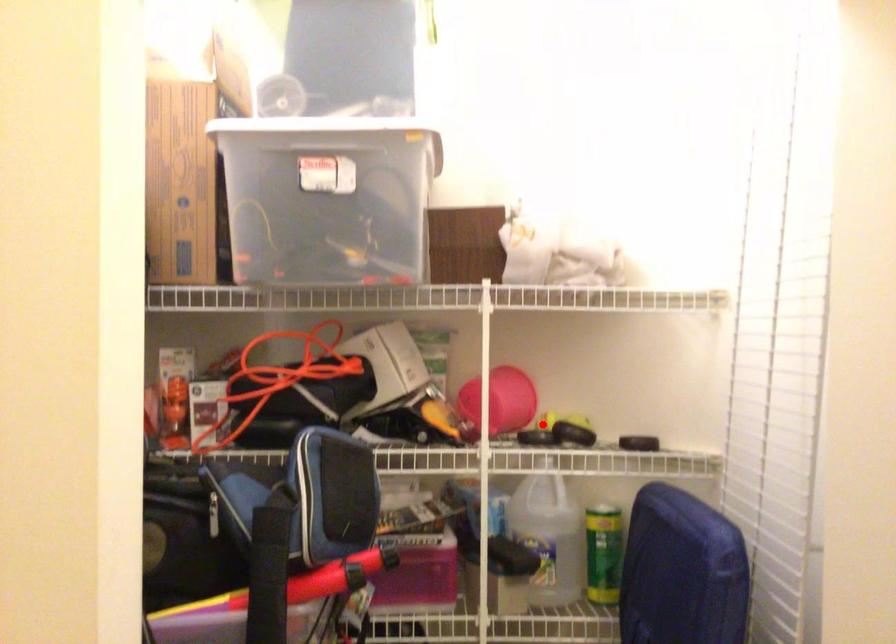
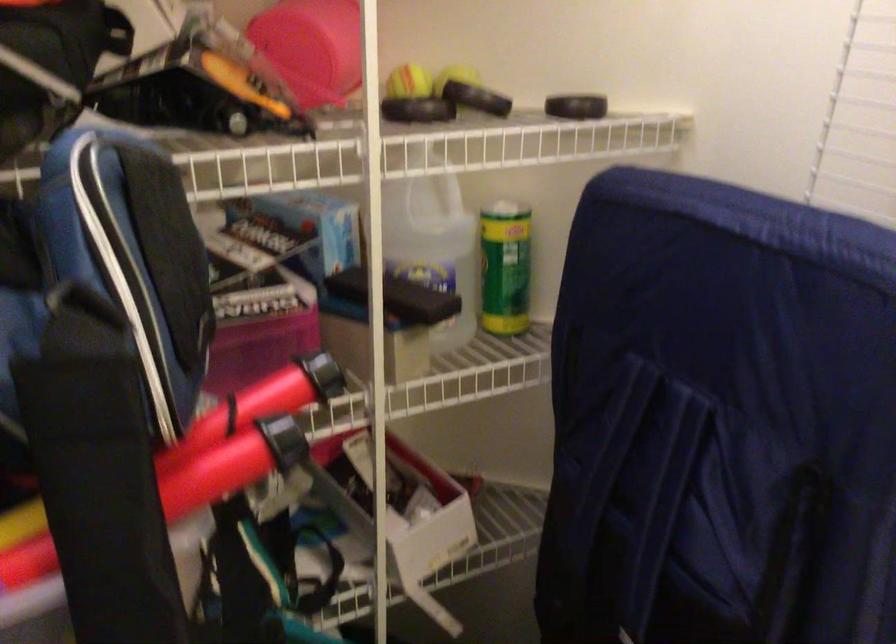
In the second image, find the point that corresponds to the highlighted location in the first image.

(409, 82)